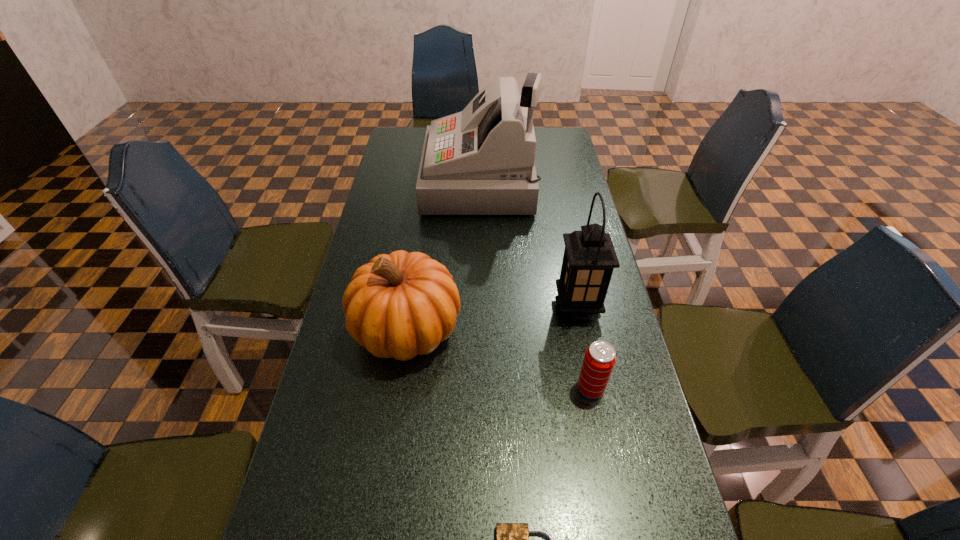
At what (x,y) coordinates should I click in order to perform the action: click on vacant point located between the fourth shortest object and the third shortest object. Please return your answer as a coordinate pair (x, y). The height and width of the screenshot is (540, 960). Looking at the image, I should click on (492, 318).

You are a GUI agent. You are given a task and a screenshot of the screen. Output one action in this format:
    pyautogui.click(x=<x>, y=<y>)
    Task: Click on the vacant space that is in between the second nearest object and the third shortest object
    
    Given the screenshot: What is the action you would take?
    pyautogui.click(x=499, y=359)

Identify the location of the second closest object relative to the second nearest object. (403, 304).

Where is `object that is the nearest to the pumpkin`? This screenshot has width=960, height=540. object that is the nearest to the pumpkin is located at coordinates (589, 259).

Locate an element on the screen. This screenshot has height=540, width=960. vacant point that satisfies the following two spatial constraints: 1. on the keypad side of the cash register; 2. on the left side of the lantern is located at coordinates (480, 307).